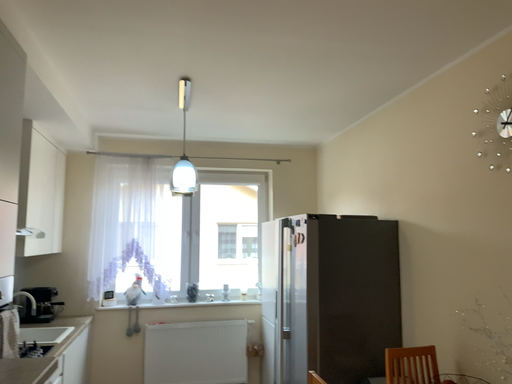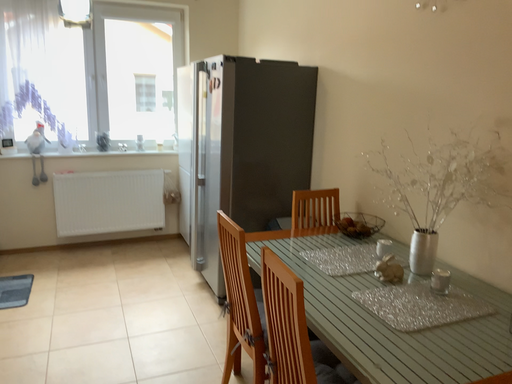
Question: Which way did the camera rotate in the video?

Choices:
 (A) rotated left
 (B) rotated right

Answer: (B)